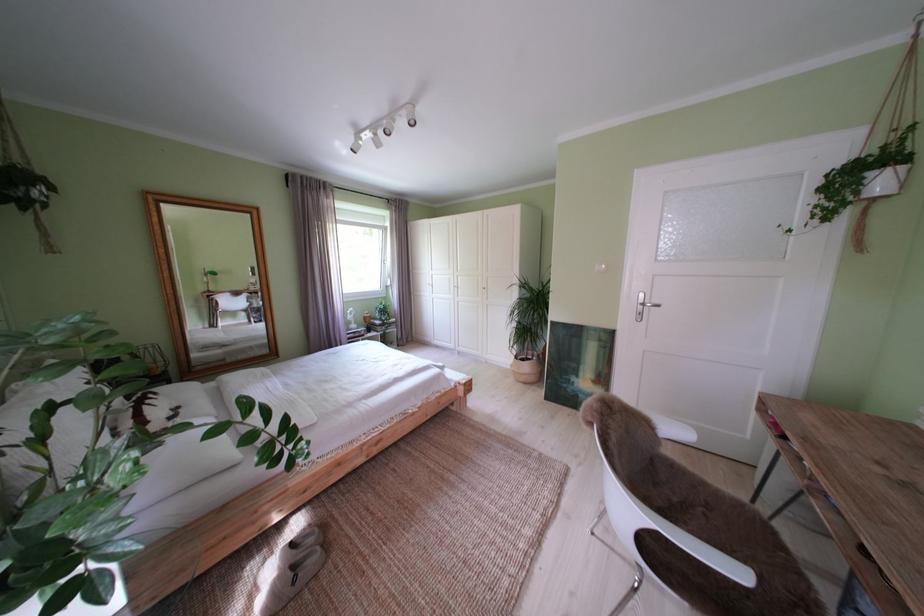
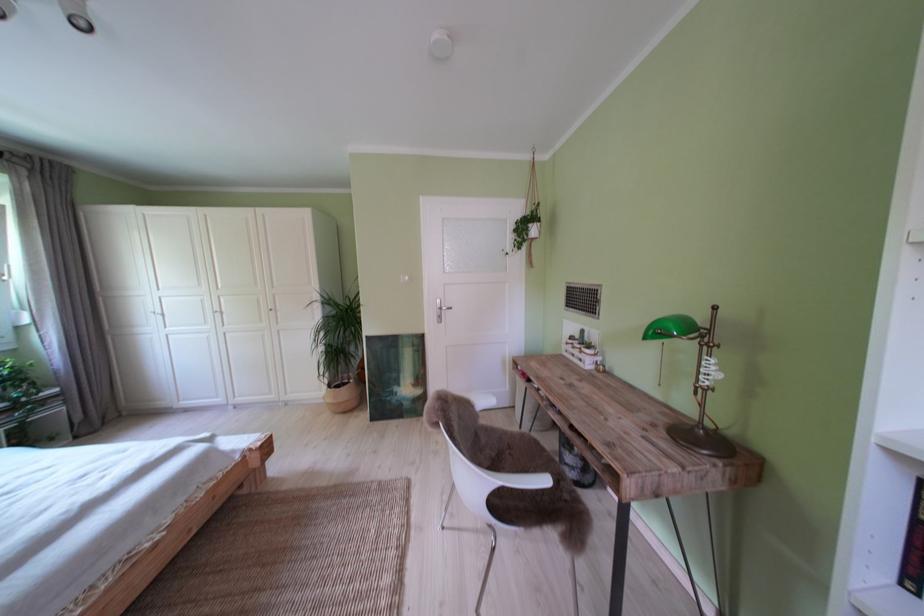
The point at (652,300) is marked in the first image. Where is the corresponding point in the second image?

(450, 307)